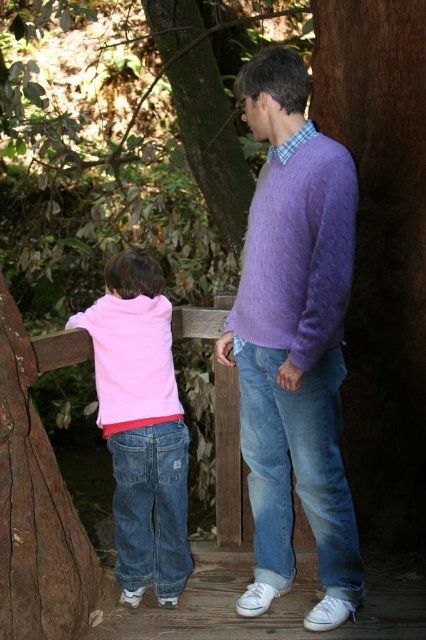
Question: Can you confirm if purple wool sweater at center is positioned to the left of pink fleece jacket at lower left?

Choices:
 (A) yes
 (B) no

Answer: (B)

Question: Which of these objects is positioned farthest from the pink fleece jacket at lower left?

Choices:
 (A) purple wool sweater at center
 (B) purple fuzzy sweater at center

Answer: (B)

Question: From the image, what is the correct spatial relationship of pink fleece jacket at lower left in relation to purple fuzzy sweater at center?

Choices:
 (A) above
 (B) below

Answer: (B)

Question: Which point is farther from the camera taking this photo?

Choices:
 (A) (242, 307)
 (B) (256, 611)
 (C) (170, 531)

Answer: (C)

Question: Can you confirm if purple wool sweater at center is wider than purple fuzzy sweater at center?

Choices:
 (A) yes
 (B) no

Answer: (A)

Question: Which object is the closest to the purple wool sweater at center?

Choices:
 (A) purple fuzzy sweater at center
 (B) pink fleece jacket at lower left

Answer: (A)